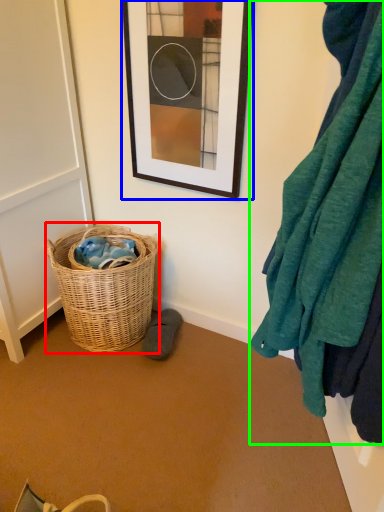
Question: Which object is the closest to the picnic basket (highlighted by a red box)? Choose among these: picture frame (highlighted by a blue box) or blanket (highlighted by a green box).

Choices:
 (A) picture frame
 (B) blanket

Answer: (A)